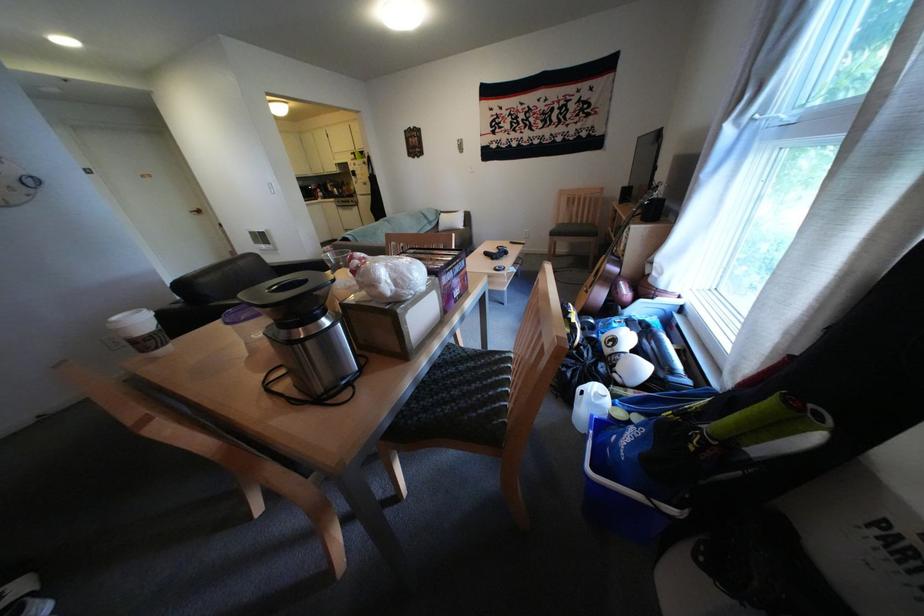
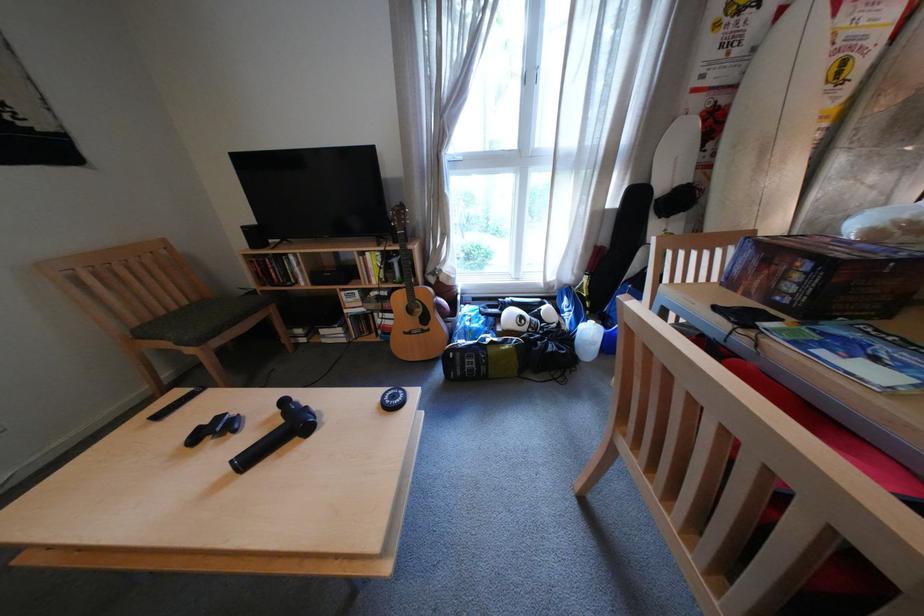
Where in the second image is the point corresponding to (x=599, y=223) from the first image?

(199, 304)